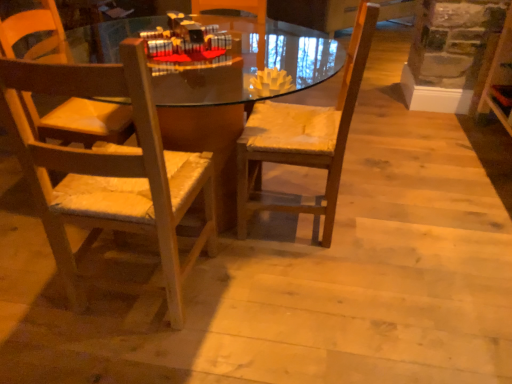
Question: Can you confirm if wooden chair with woven seat cushion at left, the second chair positioned from the right, is bigger than wooden chair at center, which is the 2th chair from left to right?

Choices:
 (A) no
 (B) yes

Answer: (B)

Question: Could you tell me if wooden chair with woven seat cushion at left, the 1th chair when ordered from left to right, is turned towards wooden chair at center, which is the 2th chair from left to right?

Choices:
 (A) no
 (B) yes

Answer: (A)

Question: Considering the relative positions of wooden chair with woven seat cushion at left, the 1th chair when ordered from left to right, and wooden chair at center, which is the 2th chair from left to right, in the image provided, is wooden chair with woven seat cushion at left, the 1th chair when ordered from left to right, to the left of wooden chair at center, which is the 2th chair from left to right, from the viewer's perspective?

Choices:
 (A) no
 (B) yes

Answer: (B)

Question: Does wooden chair with woven seat cushion at left, the 1th chair when ordered from left to right, touch wooden chair at center, which is the 2th chair from left to right?

Choices:
 (A) no
 (B) yes

Answer: (A)

Question: Is wooden chair with woven seat cushion at left, the 1th chair when ordered from left to right, far from wooden chair at center, which is the 2th chair from left to right?

Choices:
 (A) no
 (B) yes

Answer: (A)

Question: Considering their positions, is wooden chair with woven seat cushion at left, the second chair positioned from the right, located in front of or behind matte wood desk at center?

Choices:
 (A) behind
 (B) front

Answer: (B)

Question: From a real-world perspective, is wooden chair with woven seat cushion at left, the 1th chair when ordered from left to right, physically located above or below matte wood desk at center?

Choices:
 (A) below
 (B) above

Answer: (B)

Question: Do you think wooden chair with woven seat cushion at left, the 1th chair when ordered from left to right, is within matte wood desk at center, or outside of it?

Choices:
 (A) inside
 (B) outside

Answer: (A)

Question: Is wooden chair with woven seat cushion at left, the second chair positioned from the right, taller or shorter than matte wood desk at center?

Choices:
 (A) tall
 (B) short

Answer: (A)

Question: Would you say matte wood desk at center is to the left or to the right of wooden chair with woven seat cushion at left, the 1th chair when ordered from left to right, in the picture?

Choices:
 (A) left
 (B) right

Answer: (B)

Question: Is matte wood desk at center in front of or behind wooden chair with woven seat cushion at left, the second chair positioned from the right, in the image?

Choices:
 (A) front
 (B) behind

Answer: (B)

Question: From the image's perspective, is matte wood desk at center located above or below wooden chair with woven seat cushion at left, the second chair positioned from the right?

Choices:
 (A) above
 (B) below

Answer: (A)

Question: Looking at the image, does matte wood desk at center seem bigger or smaller compared to wooden chair with woven seat cushion at left, the 1th chair when ordered from left to right?

Choices:
 (A) small
 (B) big

Answer: (B)

Question: Considering their positions, is matte wood desk at center located in front of or behind wooden chair at center, which is the 2th chair from left to right?

Choices:
 (A) front
 (B) behind

Answer: (A)

Question: From the image's perspective, relative to wooden chair at center, the 1th chair from the right, is matte wood desk at center above or below?

Choices:
 (A) above
 (B) below

Answer: (B)